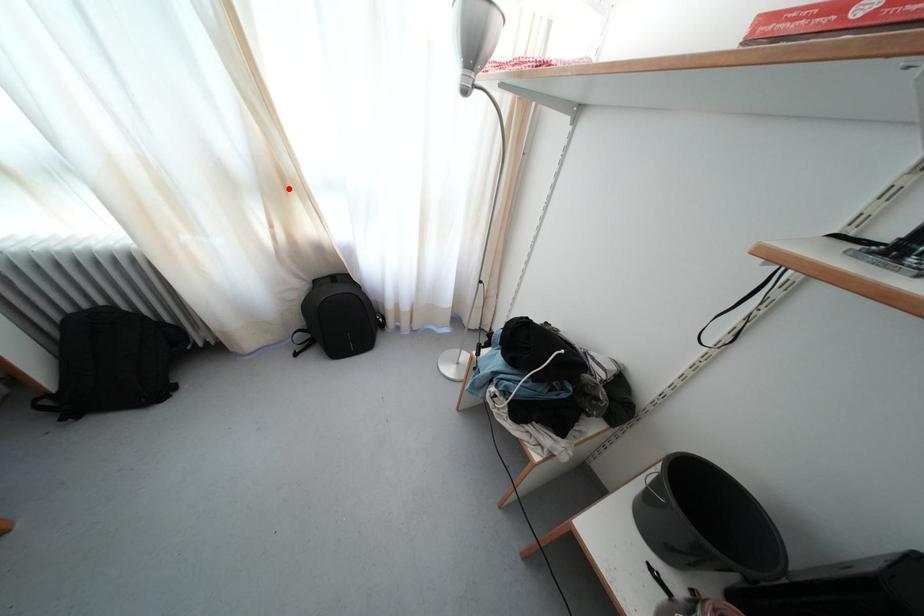
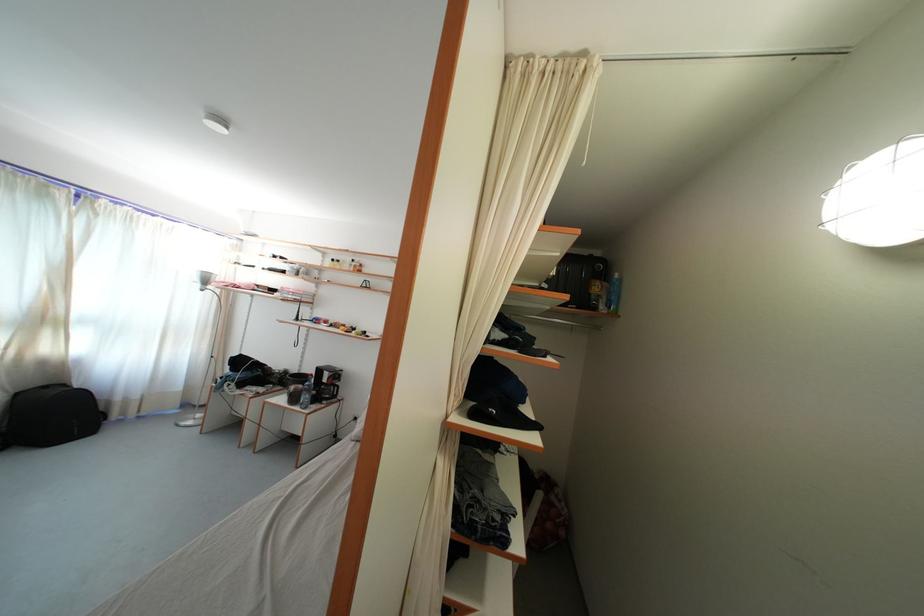
Find the pixel in the second image that matches the highlighted location in the first image.

(52, 326)